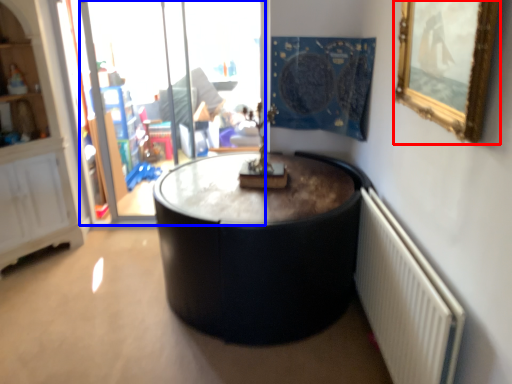
Question: Which object appears closest to the camera in this image, picture frame (highlighted by a red box) or glass door (highlighted by a blue box)?

Choices:
 (A) picture frame
 (B) glass door

Answer: (A)